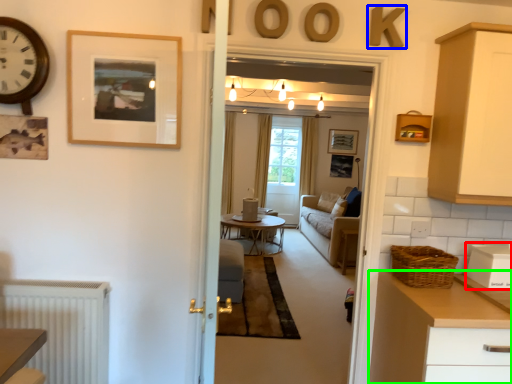
Question: Which object is the farthest from appliance (highlighted by a red box)? Choose among these: letter (highlighted by a blue box) or chest of drawers (highlighted by a green box).

Choices:
 (A) letter
 (B) chest of drawers

Answer: (A)